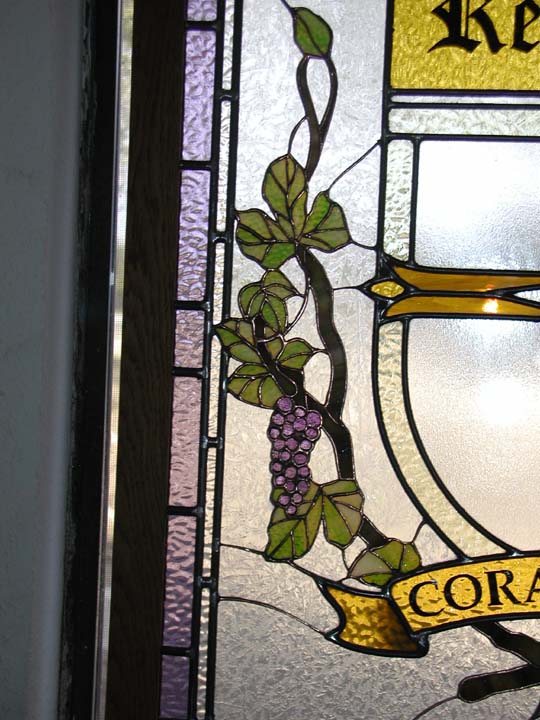
The width and height of the screenshot is (540, 720). Identify the location of frame of window/door. (77, 567).